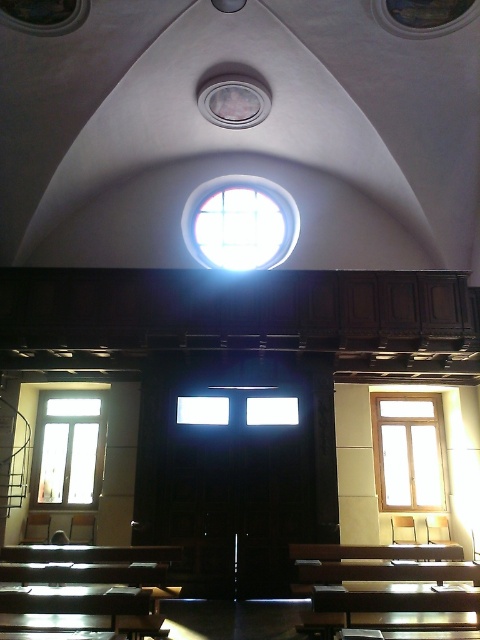
You are an interior designer planning to install new lighting fixtures in the church. You notice the clear glass window at right and the clear glass window at left. Which window should you consider for a larger fixture to maintain balance with its size?

The clear glass window at right has a larger size compared to clear glass window at left, so you should consider installing a larger lighting fixture there to match its size.

You are standing in the center of the church and looking up. Which direction should you look to see the clear glass window at center?

The clear glass window at center is located at point (240, 224), so you should look upward and slightly to your left to see it.